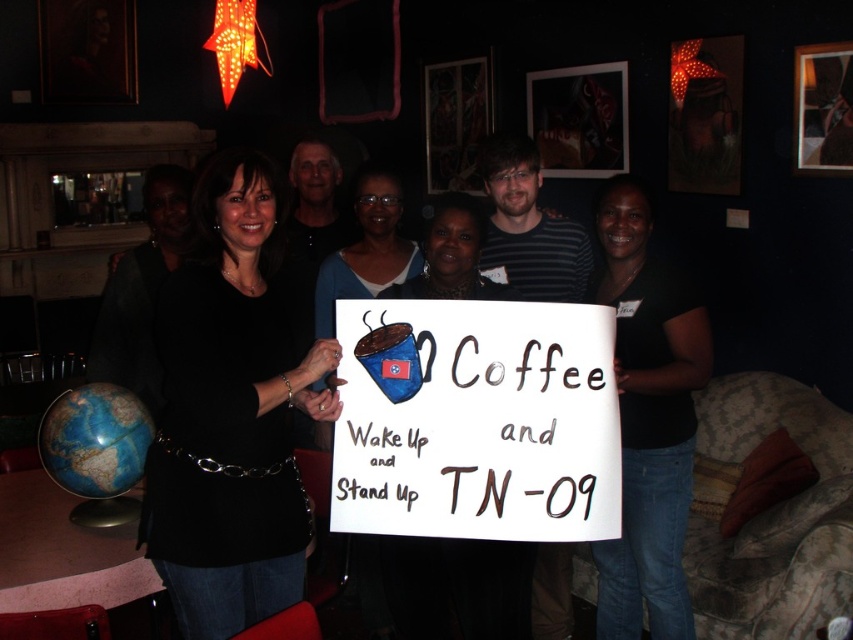
You are a photographer trying to focus on the person wearing the black matte shirt at center and the black fabric shirt at center. Which of these two shirts is positioned higher in the image?

The black matte shirt at center is located above the black fabric shirt at center, so it is positioned higher in the image.

You are a photographer who wants to focus on the white paper sign at center. Where should you position the camera to ensure the sign is centered in the frame?

Position the camera at point (x=477, y=420) to center the white paper sign at center in the frame.